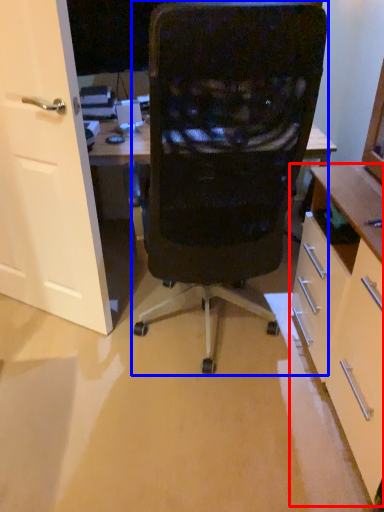
Question: Among these objects, which one is farthest to the camera, cabinetry (highlighted by a red box) or chair (highlighted by a blue box)?

Choices:
 (A) cabinetry
 (B) chair

Answer: (B)